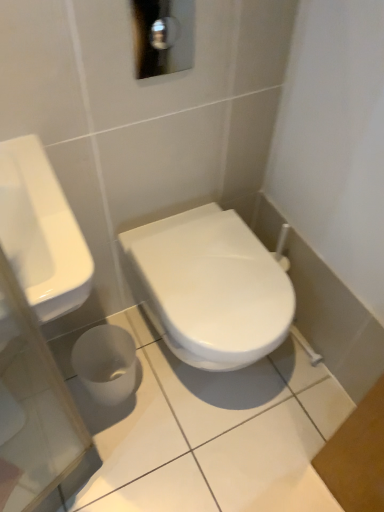
Image resolution: width=384 pixels, height=512 pixels. In order to click on free space above white glossy sink at left (from a real-world perspective) in this screenshot , I will do `click(31, 196)`.